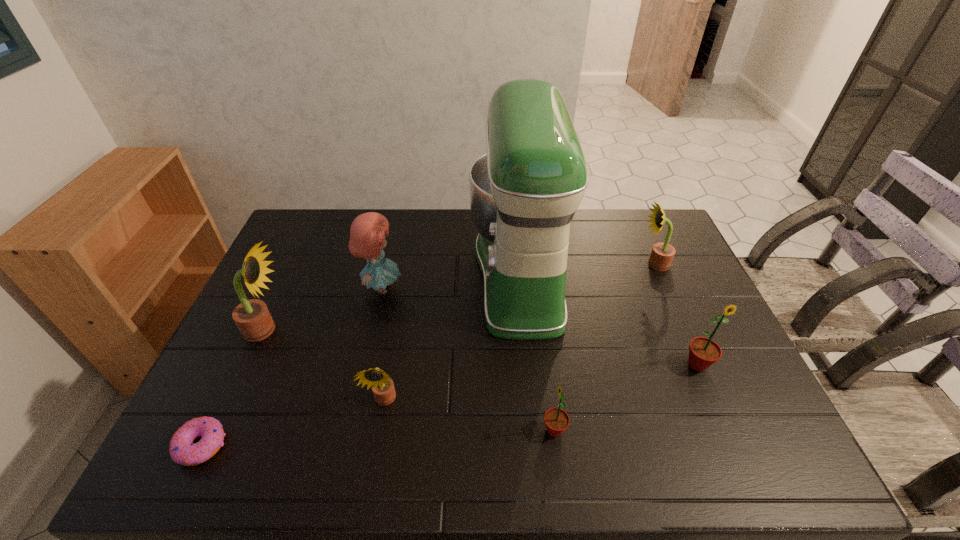
The width and height of the screenshot is (960, 540). I want to click on free area in between the nearest sunflower and the right green sunflower, so click(x=626, y=397).

I want to click on free space between the leftmost yellow sunflower and the left green sunflower, so click(x=410, y=380).

Find the location of a particular element. This screenshot has width=960, height=540. empty location between the doughnut and the second sunflower from left to right is located at coordinates (293, 423).

Where is `blank region between the leftmost sunflower and the rightmost yellow sunflower`? The width and height of the screenshot is (960, 540). blank region between the leftmost sunflower and the rightmost yellow sunflower is located at coordinates (460, 297).

The width and height of the screenshot is (960, 540). What are the coordinates of `free point between the second smallest yellow sunflower and the left green sunflower` in the screenshot? It's located at (604, 347).

This screenshot has height=540, width=960. What are the coordinates of `free space that is in between the nearer green sunflower and the blue doll` in the screenshot? It's located at (468, 359).

Image resolution: width=960 pixels, height=540 pixels. In order to click on free space between the tallest object and the pink doughnut in this screenshot , I will do `click(361, 360)`.

Image resolution: width=960 pixels, height=540 pixels. What are the coordinates of `free spot between the mixer and the doll` in the screenshot? It's located at (451, 281).

Identify which object is located as the fifth nearest to the green mixer. Please provide its 2D coordinates. Your answer should be formatted as a tuple, i.e. [(x, y)], where the tuple contains the x and y coordinates of a point satisfying the conditions above.

[(703, 352)]

Where is `object that is the fourth closest one to the tallest object`? The height and width of the screenshot is (540, 960). object that is the fourth closest one to the tallest object is located at coordinates (556, 420).